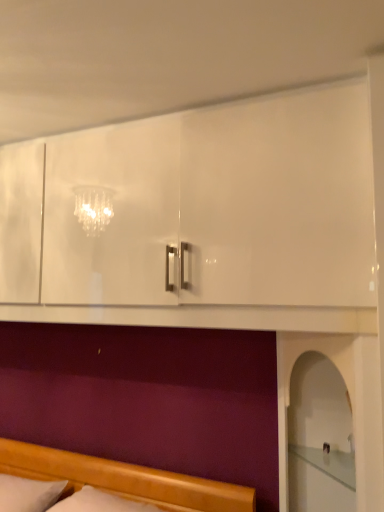
The width and height of the screenshot is (384, 512). What do you see at coordinates (124, 479) in the screenshot?
I see `wooden bed at lower left` at bounding box center [124, 479].

At what (x,y) coordinates should I click in order to perform the action: click on wooden bed at lower left. Please return your answer as a coordinate pair (x, y). The image size is (384, 512). Looking at the image, I should click on (124, 479).

Can you confirm if white soft pillow at lower left is bigger than wooden bed at lower left?

No, white soft pillow at lower left is not bigger than wooden bed at lower left.

Is white soft pillow at lower left oriented towards wooden bed at lower left?

No, white soft pillow at lower left is not aimed at wooden bed at lower left.

Does point (4, 497) lie behind point (232, 496)?

Yes.

From a real-world perspective, which object rests below the other?

white soft pillow at lower left.

Relative to white soft pillow at lower left, is white glossy mantle at lower center in front or behind?

white glossy mantle at lower center is in front of white soft pillow at lower left.

Is white glossy mantle at lower center outside of white soft pillow at lower left?

Yes, white glossy mantle at lower center is not within white soft pillow at lower left.

Is white glossy mantle at lower center positioned with its back to white soft pillow at lower left?

No, white glossy mantle at lower center's orientation is not away from white soft pillow at lower left.

Is wooden bed at lower left completely or partially outside of white glossy mantle at lower center?

Indeed, wooden bed at lower left is completely outside white glossy mantle at lower center.

Considering the relative sizes of wooden bed at lower left and white glossy mantle at lower center in the image provided, is wooden bed at lower left taller than white glossy mantle at lower center?

Yes, wooden bed at lower left is taller than white glossy mantle at lower center.

Find the location of `bed lying below the white glossy mantle at lower center (from the image's perspective)`. bed lying below the white glossy mantle at lower center (from the image's perspective) is located at coordinates (124, 479).

Between point (146, 469) and point (167, 318), which one is positioned behind?

Point (146, 469)

How many degrees apart are the facing directions of white glossy mantle at lower center and wooden bed at lower left?

There is a 0.626-degree angle between the facing directions of white glossy mantle at lower center and wooden bed at lower left.

Are white glossy mantle at lower center and wooden bed at lower left far apart?

white glossy mantle at lower center is actually quite close to wooden bed at lower left.

Locate an element on the screen. The image size is (384, 512). bed lying below the white glossy mantle at lower center (from the image's perspective) is located at coordinates click(124, 479).

Does point (125, 308) come closer to viewer compared to point (205, 509)?

Yes, point (125, 308) is in front of point (205, 509).

Identify the location of mantle above the white soft pillow at lower left (from the image's perspective). (205, 317).

Considering the relative sizes of white soft pillow at lower left and white glossy mantle at lower center in the image provided, is white soft pillow at lower left smaller than white glossy mantle at lower center?

No, white soft pillow at lower left is not smaller than white glossy mantle at lower center.

Looking at this image, can you confirm if white soft pillow at lower left is thinner than white glossy mantle at lower center?

Indeed, white soft pillow at lower left has a lesser width compared to white glossy mantle at lower center.

Which of these two, white soft pillow at lower left or white glossy mantle at lower center, stands taller?

Standing taller between the two is white soft pillow at lower left.

Measure the distance between wooden bed at lower left and white soft pillow at lower left.

9.80 inches.

Between wooden bed at lower left and white soft pillow at lower left, which one has less height?

Standing shorter between the two is wooden bed at lower left.

Which point is more forward, (230, 497) or (30, 484)?

The point (230, 497) is closer.

Considering the positions of objects wooden bed at lower left and white soft pillow at lower left in the image provided, who is more to the left, wooden bed at lower left or white soft pillow at lower left?

white soft pillow at lower left.

Identify the location of pillow behind the wooden bed at lower left. (28, 494).

Locate an element on the screen. Image resolution: width=384 pixels, height=512 pixels. pillow on the left of white glossy mantle at lower center is located at coordinates (28, 494).

Which object lies further to the anchor point white glossy mantle at lower center, wooden bed at lower left or white soft pillow at lower left?

The object further to white glossy mantle at lower center is white soft pillow at lower left.

Estimate the real-world distances between objects in this image. Which object is closer to wooden bed at lower left, white glossy mantle at lower center or white soft pillow at lower left?

Among the two, white soft pillow at lower left is located nearer to wooden bed at lower left.

Looking at the image, which one is located further to white soft pillow at lower left, white glossy mantle at lower center or wooden bed at lower left?

white glossy mantle at lower center.

Based on their spatial positions, is white soft pillow at lower left or white glossy mantle at lower center closer to wooden bed at lower left?

white soft pillow at lower left is closer to wooden bed at lower left.

Consider the image. Which object lies nearer to the anchor point white soft pillow at lower left, wooden bed at lower left or white glossy mantle at lower center?

wooden bed at lower left.

When comparing their distances from white glossy mantle at lower center, does white soft pillow at lower left or wooden bed at lower left seem closer?

wooden bed at lower left lies closer to white glossy mantle at lower center than the other object.

The height and width of the screenshot is (512, 384). I want to click on bed that lies between white glossy mantle at lower center and white soft pillow at lower left from top to bottom, so click(124, 479).